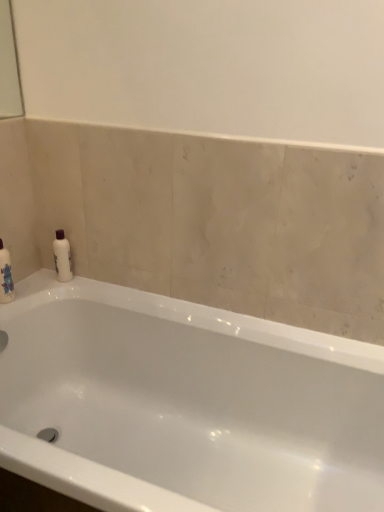
This screenshot has width=384, height=512. What are the coordinates of `free space that is to the left of white glossy bottle at upper left` in the screenshot? It's located at (42, 277).